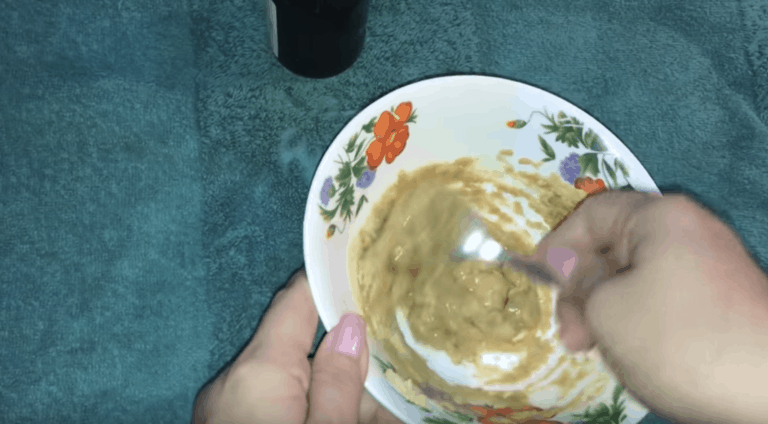
The height and width of the screenshot is (424, 768). I want to click on bowl, so click(447, 119).